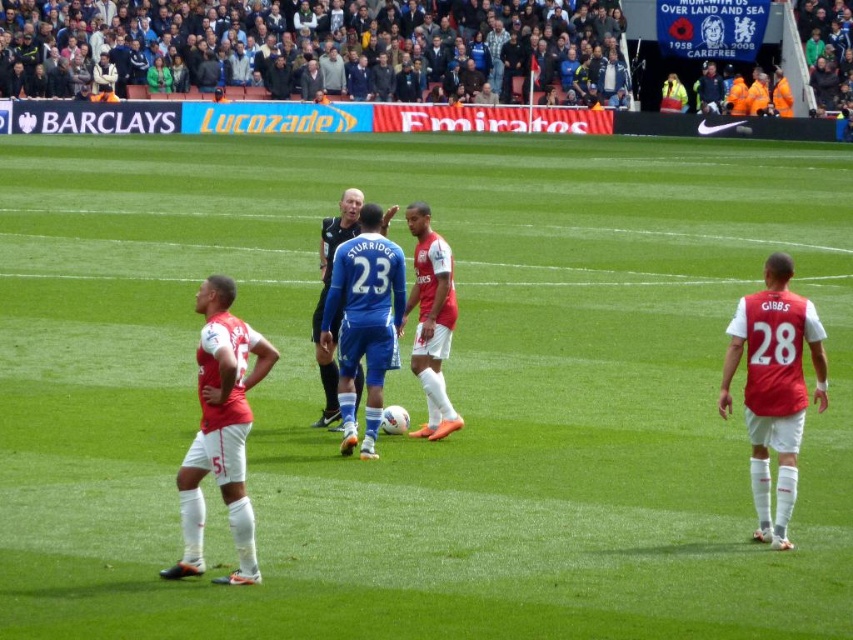
You are a photographer at the soccer match. You want to take a photo that includes both the matte red jersey at right and the matte red soccer player at center. Which object should you focus on first if you want to ensure both are in the frame?

The matte red jersey at right has a lesser height compared to the matte red soccer player at center, so you should focus on the taller matte red soccer player at center first to ensure both are in the frame.

You are a photographer positioned at the edge of the soccer field. You want to take a photo of the matte red soccer player at center without the matte red jersey at right blocking the view. Is this possible based on their current positions?

The matte red jersey at right is in front of the matte red soccer player at center, so the jersey would block the view of the soccer player. To avoid the blockage, you would need to adjust your position or angle to ensure the jersey is no longer in front of the player.